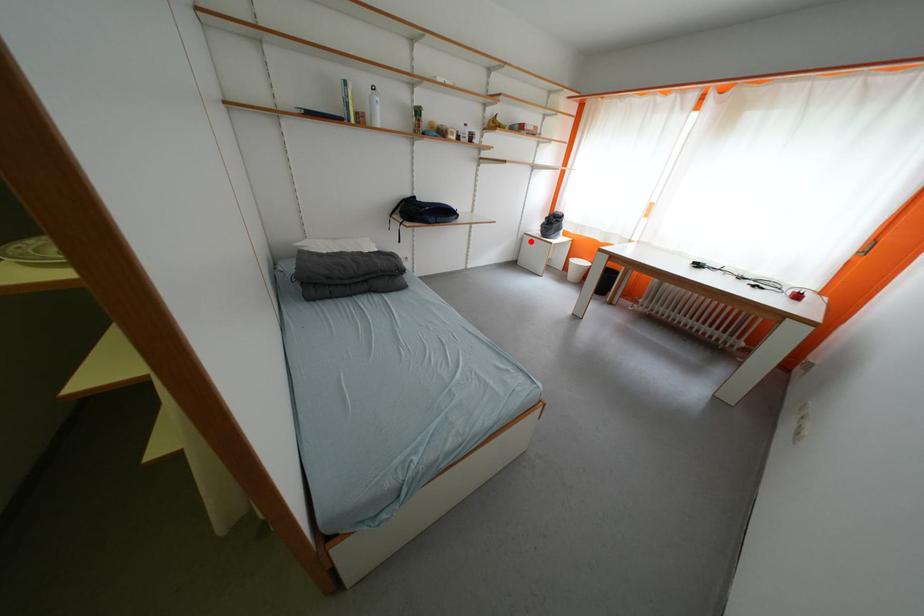
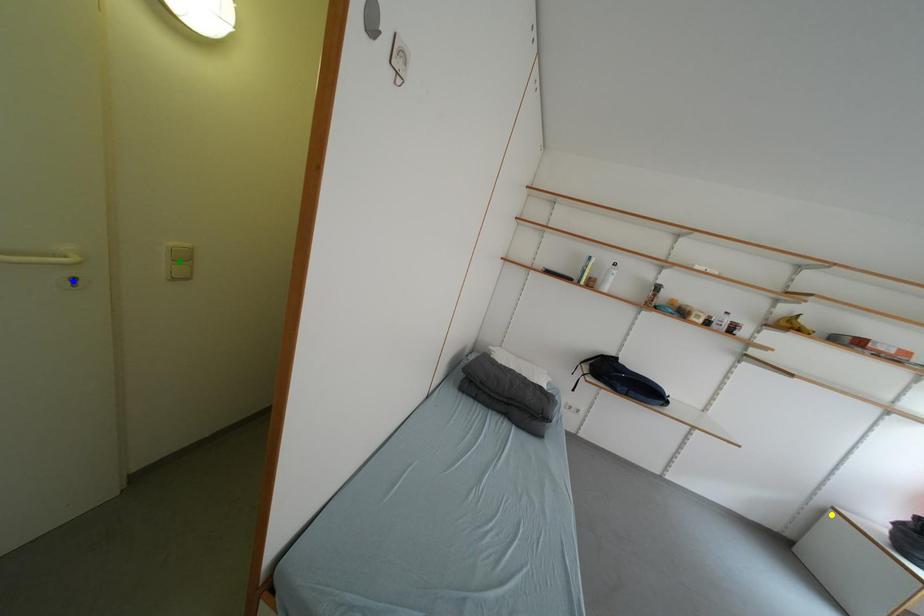
Question: I am providing you with two images of the same scene from different viewpoints. A red point is marked on the first image. You are given multiple points on the second image. In image 2, which mark is for the same physical point as the one in image 1?

Choices:
 (A) yellow point
 (B) green point
 (C) blue point

Answer: (A)